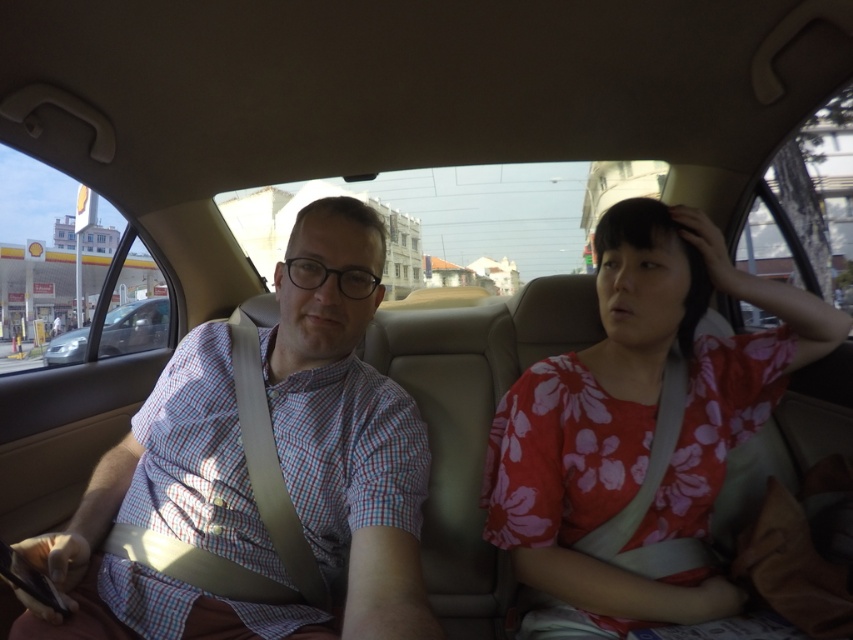
Who is positioned more to the left, checkered fabric shirt at left or metallic silver sedan at left?

From the viewer's perspective, metallic silver sedan at left appears more on the left side.

Is point (206, 422) farther from viewer compared to point (57, 339)?

No, it is in front of (57, 339).

Which is behind, point (347, 438) or point (76, 349)?

Positioned behind is point (76, 349).

You are a GUI agent. You are given a task and a screenshot of the screen. Output one action in this format:
    pyautogui.click(x=<x>, y=<y>)
    Task: Click on the checkered fabric shirt at left
    
    Given the screenshot: What is the action you would take?
    pyautogui.click(x=250, y=476)

Can you confirm if checkered fabric shirt at left is positioned to the right of floral cotton shirt at right?

Incorrect, checkered fabric shirt at left is not on the right side of floral cotton shirt at right.

Can you confirm if checkered fabric shirt at left is smaller than floral cotton shirt at right?

No, checkered fabric shirt at left is not smaller than floral cotton shirt at right.

What do you see at coordinates (250, 476) in the screenshot?
I see `checkered fabric shirt at left` at bounding box center [250, 476].

Where is `checkered fabric shirt at left`? The width and height of the screenshot is (853, 640). checkered fabric shirt at left is located at coordinates click(x=250, y=476).

Looking at this image, does floral cotton shirt at right appear under metallic silver sedan at left?

Yes, floral cotton shirt at right is below metallic silver sedan at left.

Does point (686, 598) come farther from viewer compared to point (132, 305)?

No.

Identify the location of floral cotton shirt at right. (641, 424).